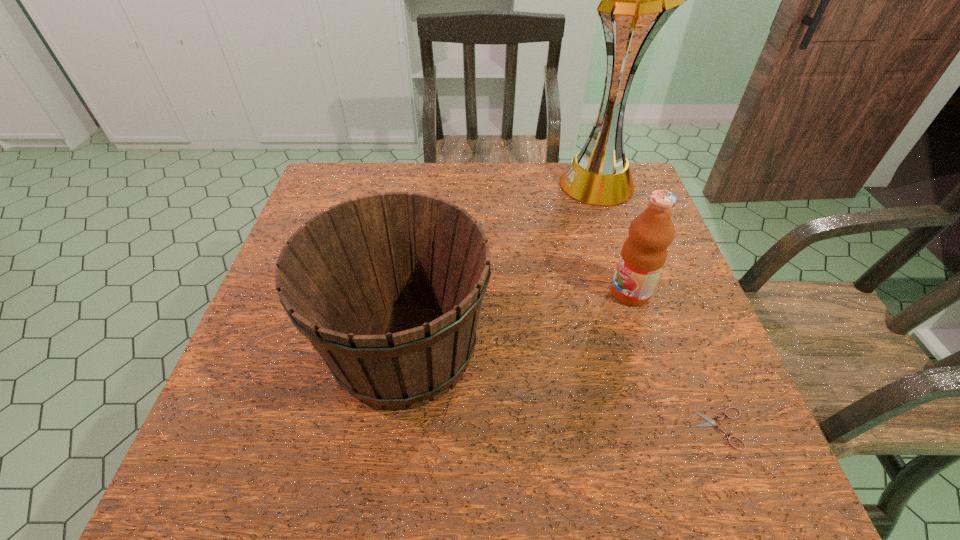
Find the location of a particular element. Image resolution: width=960 pixels, height=540 pixels. free location that satisfies the following two spatial constraints: 1. on the front label of the fruit juice; 2. on the right side of the shortest object is located at coordinates pos(673,428).

I want to click on free space that satisfies the following two spatial constraints: 1. on the front label of the fruit juice; 2. on the back side of the shears, so click(x=673, y=428).